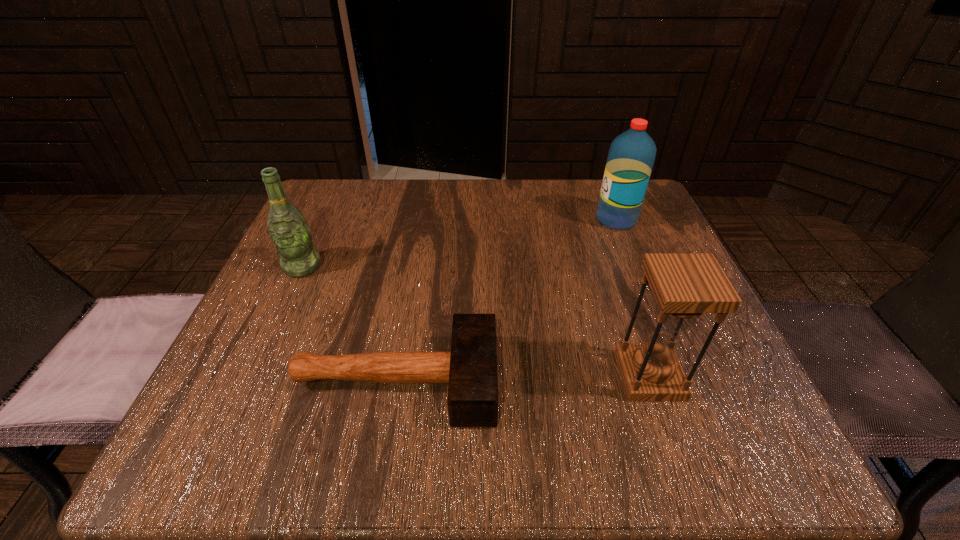
At what (x,y) coordinates should I click in order to perform the action: click on vacant space at the far edge. Please return your answer as a coordinate pair (x, y). The width and height of the screenshot is (960, 540). Looking at the image, I should click on (531, 204).

In order to click on free space at the near edge of the desktop in this screenshot , I will do `click(545, 430)`.

At what (x,y) coordinates should I click in order to perform the action: click on vacant area at the left edge. Please return your answer as a coordinate pair (x, y). This screenshot has width=960, height=540. Looking at the image, I should click on (349, 245).

At what (x,y) coordinates should I click in order to perform the action: click on vacant area at the right edge of the desktop. Please return your answer as a coordinate pair (x, y). Image resolution: width=960 pixels, height=540 pixels. Looking at the image, I should click on (706, 320).

You are a GUI agent. You are given a task and a screenshot of the screen. Output one action in this format:
    pyautogui.click(x=<x>, y=<y>)
    Task: Click on the vacant region at the far left corner of the desktop
    This screenshot has width=960, height=540.
    Given the screenshot: What is the action you would take?
    pyautogui.click(x=374, y=183)

At what (x,y) coordinates should I click in order to perform the action: click on vacant space at the near left corner of the desktop. Please return your answer as a coordinate pair (x, y). Looking at the image, I should click on (273, 442).

This screenshot has height=540, width=960. Find the location of `free space between the farthest object and the hourglass`. free space between the farthest object and the hourglass is located at coordinates (633, 298).

The image size is (960, 540). What are the coordinates of `free space that is in between the mallet and the farthest object` in the screenshot? It's located at (506, 300).

Find the location of a particular element. vacant space in between the hourglass and the farthest object is located at coordinates (633, 298).

This screenshot has height=540, width=960. What are the coordinates of `blank region between the water bottle and the beer bottle` in the screenshot? It's located at (460, 243).